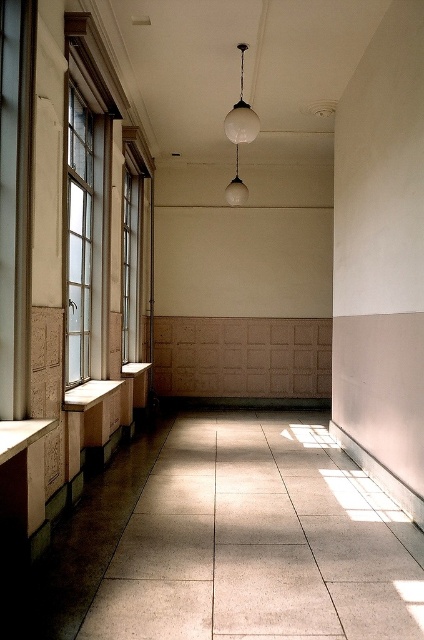
The image size is (424, 640). What do you see at coordinates (78, 236) in the screenshot? I see `clear glass window at left` at bounding box center [78, 236].

Does point (67, 173) come closer to viewer compared to point (245, 48)?

That is True.

Locate an element on the screen. Image resolution: width=424 pixels, height=640 pixels. clear glass window at left is located at coordinates (78, 236).

Is clear glass window at left below wooden bench at left?

No, clear glass window at left is not below wooden bench at left.

What do you see at coordinates (78, 236) in the screenshot?
I see `clear glass window at left` at bounding box center [78, 236].

Identify the location of clear glass window at left. (78, 236).

Does wooden bench at left appear under white glass pendant light at center?

Correct, wooden bench at left is located below white glass pendant light at center.

From the picture: Which is above, wooden bench at left or white glass pendant light at center?

white glass pendant light at center is higher up.

Is point (97, 419) farther from camera compared to point (226, 115)?

No.

Identify the location of wooden bench at left. (88, 419).